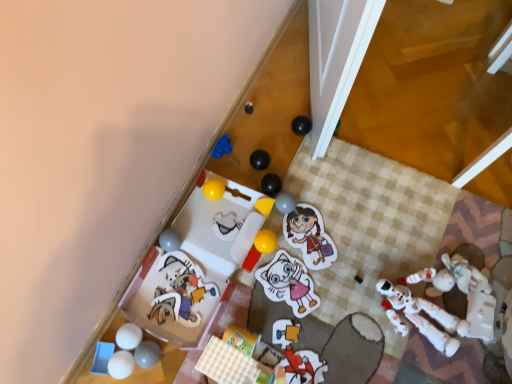
Locate an element on the screen. The width and height of the screenshot is (512, 384). empty space that is in between white matte cat at center, which is counted as the 2th toy, starting from the right, and white plastic toy at lower right, the fifteenth toy viewed from the left is located at coordinates pos(348,301).